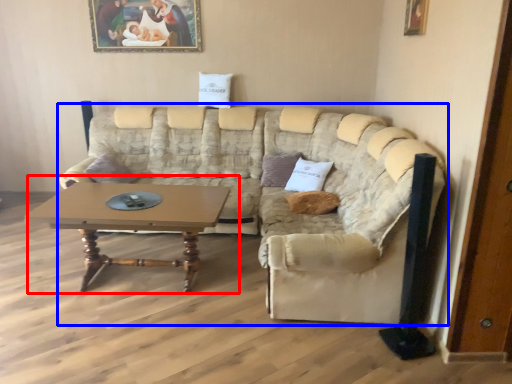
Question: Among these objects, which one is nearest to the camera, coffee table (highlighted by a red box) or studio couch (highlighted by a blue box)?

Choices:
 (A) coffee table
 (B) studio couch

Answer: (B)